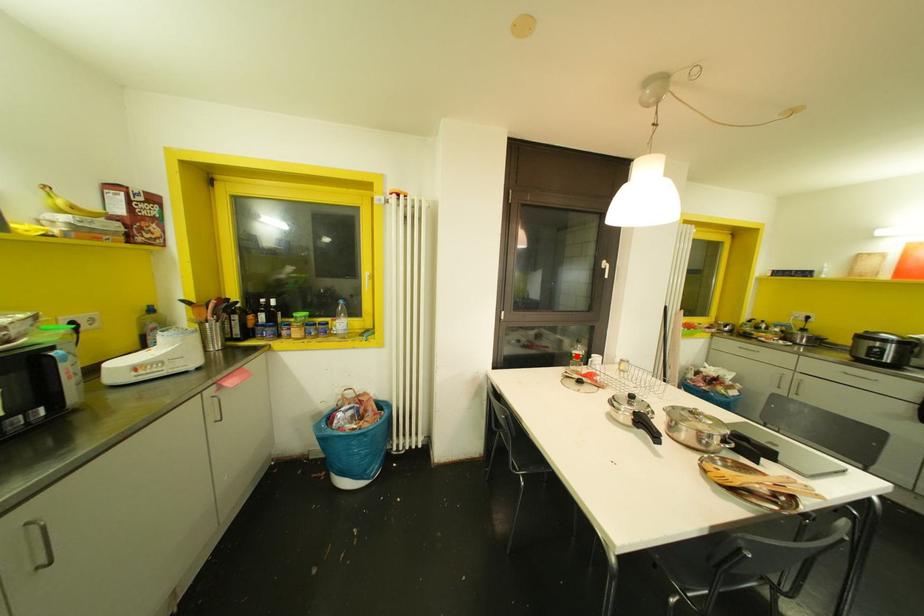
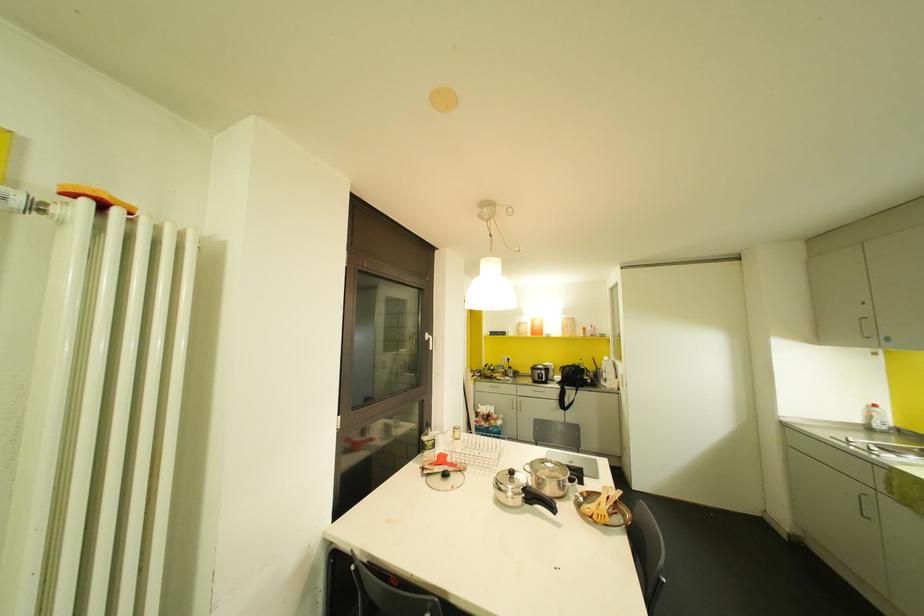
Question: I am providing you with two images of the same scene from different viewpoints. A red point is shown in image1. For the corresponding object point in image2, is it positioned nearer or farther from the camera?

Choices:
 (A) Nearer
 (B) Farther

Answer: (B)